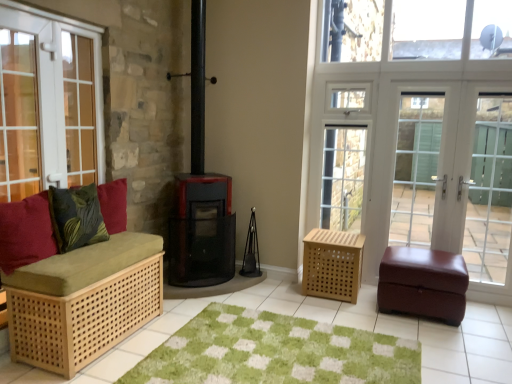
At what (x,y) coordinates should I click in order to perform the action: click on vacant area in front of light brown woven basket at center-right, which ranks as the 2th furniture in left-to-right order. Please return your answer as a coordinate pair (x, y). The height and width of the screenshot is (384, 512). Looking at the image, I should click on (341, 309).